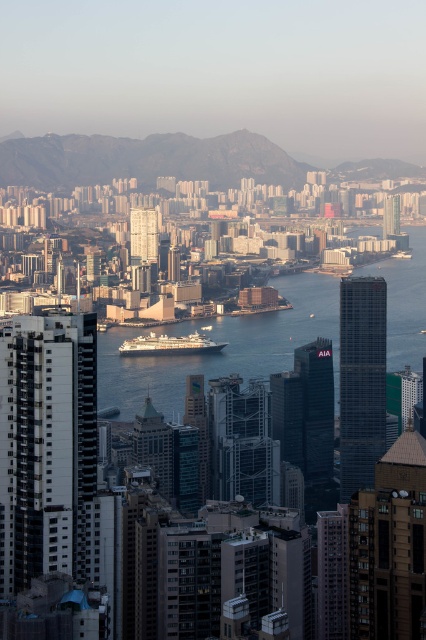
Is clear blue water at center taller than rocky mountain at upper center?

Correct, clear blue water at center is much taller as rocky mountain at upper center.

This screenshot has width=426, height=640. Find the location of `clear blue water at center`. clear blue water at center is located at coordinates (224, 348).

Where is `clear blue water at center`? This screenshot has height=640, width=426. clear blue water at center is located at coordinates (224, 348).

Which is more to the left, clear blue water at center or white glossy cruise ship at center?

white glossy cruise ship at center is more to the left.

Who is lower down, clear blue water at center or white glossy cruise ship at center?

Positioned lower is clear blue water at center.

Is point (209, 332) positioned in front of point (213, 349)?

No, it is behind (213, 349).

Where is `clear blue water at center`? The image size is (426, 640). clear blue water at center is located at coordinates (224, 348).

Between rocky mountain at upper center and white glossy cruise ship at center, which one has more height?

With more height is rocky mountain at upper center.

Can you confirm if rocky mountain at upper center is positioned above white glossy cruise ship at center?

Indeed, rocky mountain at upper center is positioned over white glossy cruise ship at center.

At what (x,y) coordinates should I click in order to perform the action: click on rocky mountain at upper center. Please return your answer as a coordinate pair (x, y). Looking at the image, I should click on (146, 160).